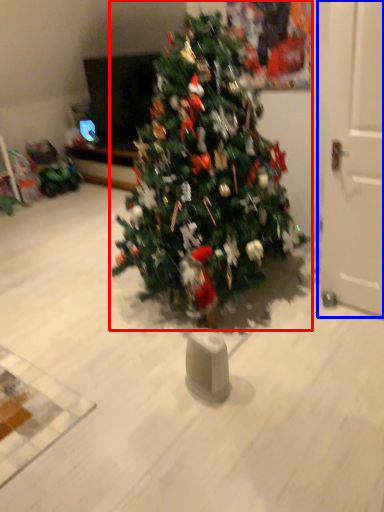
Question: Which of the following is the closest to the observer, christmas tree (highlighted by a red box) or door (highlighted by a blue box)?

Choices:
 (A) christmas tree
 (B) door

Answer: (A)